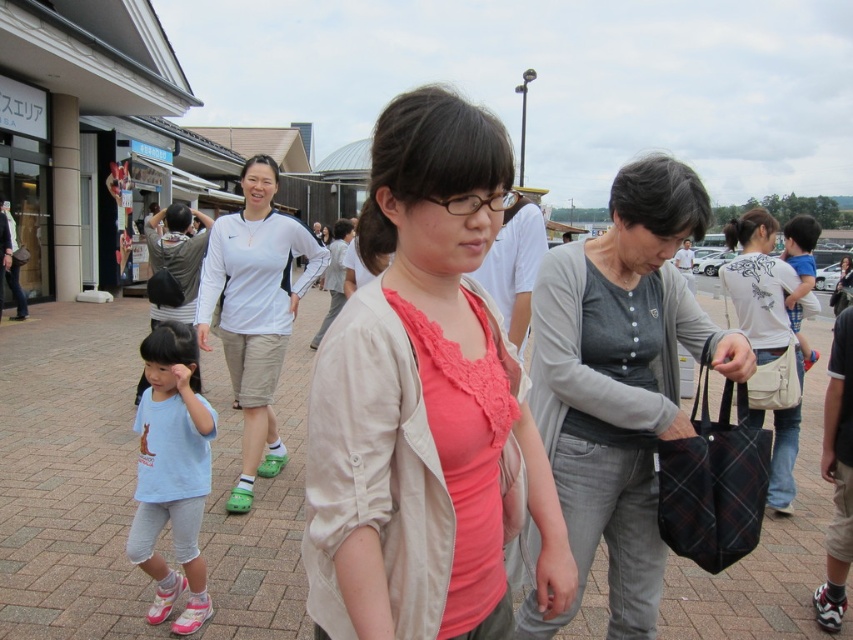
Question: Is light blue cotton shirt at left wider than matte white shirt at center?

Choices:
 (A) no
 (B) yes

Answer: (A)

Question: Among these points, which one is farthest from the camera?

Choices:
 (A) (218, 230)
 (B) (158, 474)

Answer: (A)

Question: Which point is closer to the camera?

Choices:
 (A) (579, 428)
 (B) (257, 289)
 (C) (403, 358)

Answer: (C)

Question: Does pink fabric shirt at center have a larger size compared to white fabric shirt at center?

Choices:
 (A) no
 (B) yes

Answer: (A)

Question: Which of the following is the closest to the observer?

Choices:
 (A) (248, 234)
 (B) (387, 584)
 (C) (640, 280)
 (D) (160, 244)

Answer: (B)

Question: Is pink fabric shirt at center above white fabric shirt at center?

Choices:
 (A) yes
 (B) no

Answer: (B)